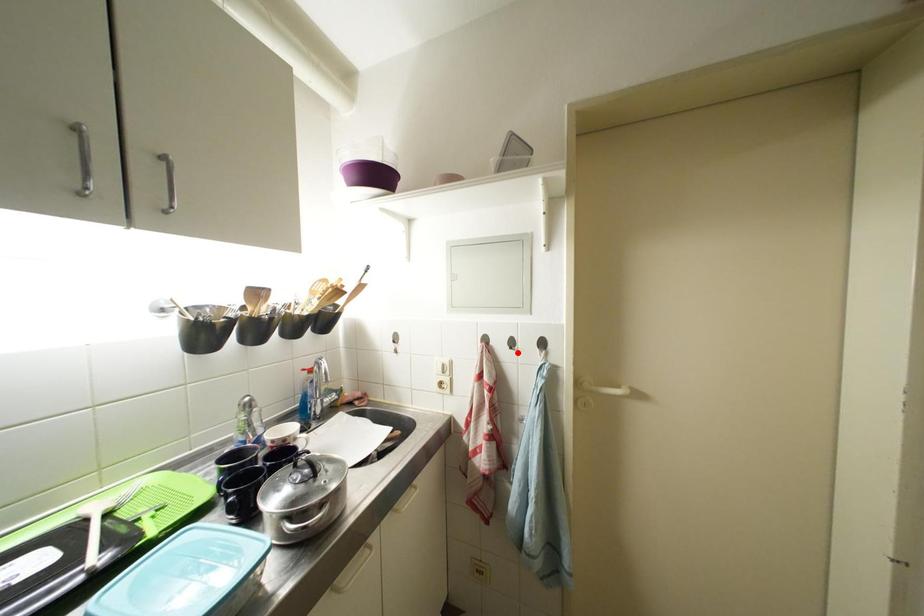
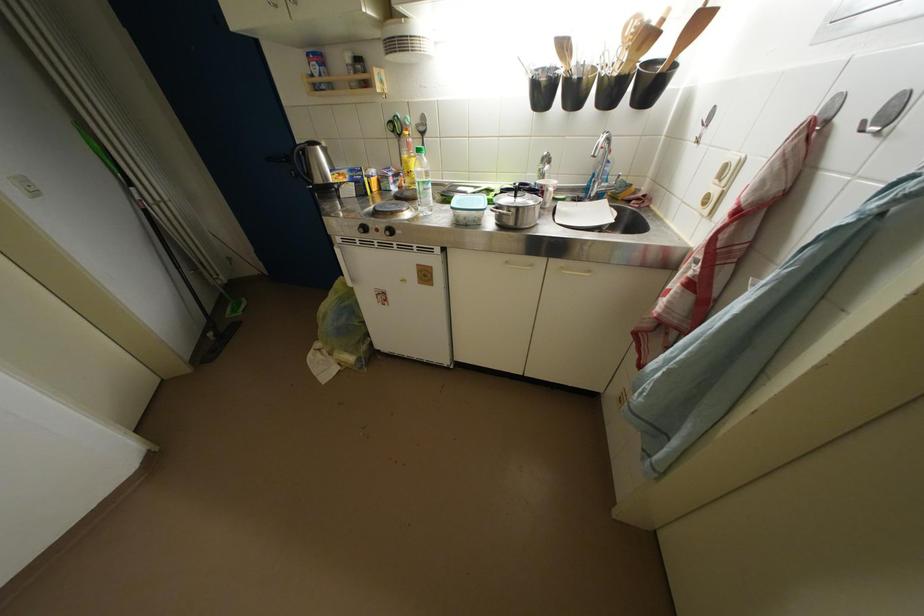
Find the pixel in the second image that matches the highlighted location in the first image.

(869, 132)